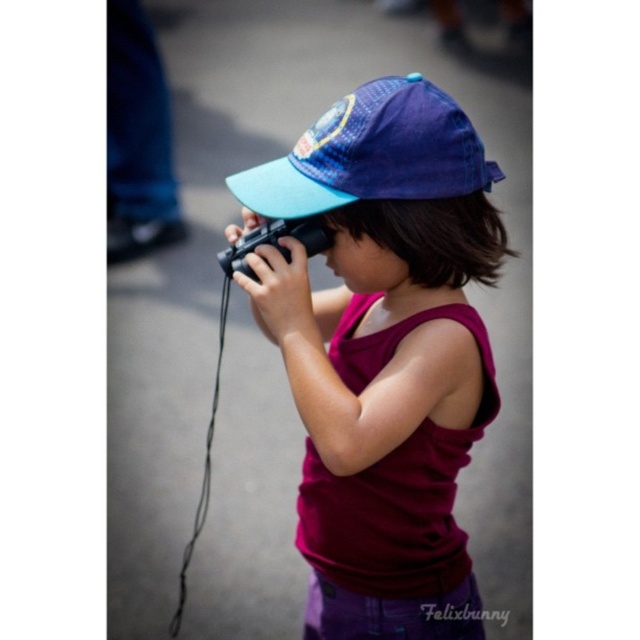
Question: In this image, where is matte blue cap at center located relative to black plastic camera at center?

Choices:
 (A) below
 (B) above

Answer: (A)

Question: Among these points, which one is nearest to the camera?

Choices:
 (A) (316, 224)
 (B) (378, 186)

Answer: (B)

Question: Does blue fabric baseball cap at center appear over black plastic camera at center?

Choices:
 (A) no
 (B) yes

Answer: (B)

Question: Can you confirm if matte blue cap at center is positioned above blue fabric baseball cap at center?

Choices:
 (A) yes
 (B) no

Answer: (B)

Question: Which point appears closest to the camera in this image?

Choices:
 (A) (381, 456)
 (B) (406, 193)

Answer: (A)

Question: Which of these objects is positioned closest to the black plastic camera at center?

Choices:
 (A) blue fabric baseball cap at center
 (B) matte blue cap at center

Answer: (A)